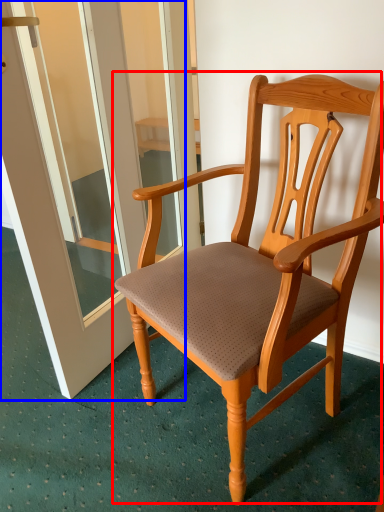
Question: Which of the following is the closest to the observer, chair (highlighted by a red box) or screen door (highlighted by a blue box)?

Choices:
 (A) chair
 (B) screen door

Answer: (A)